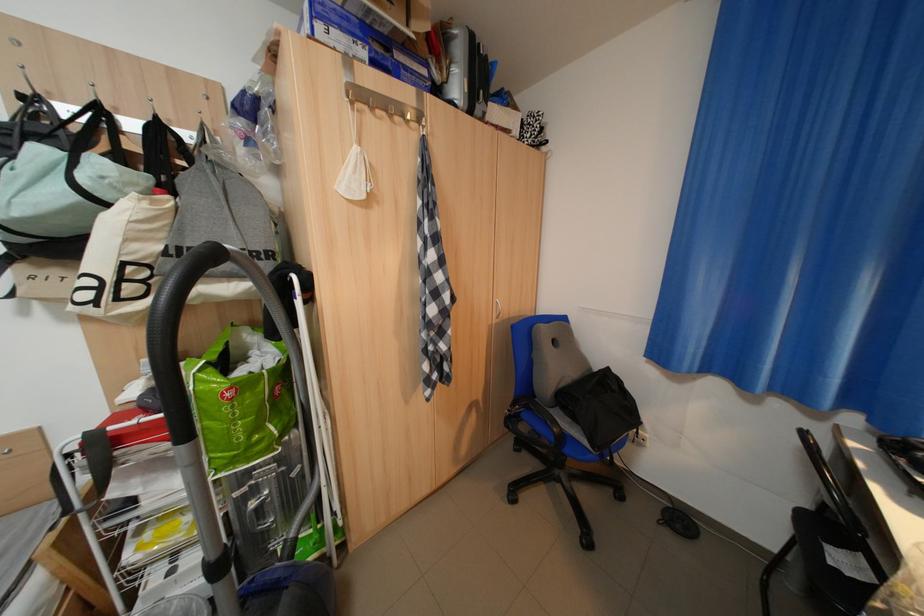
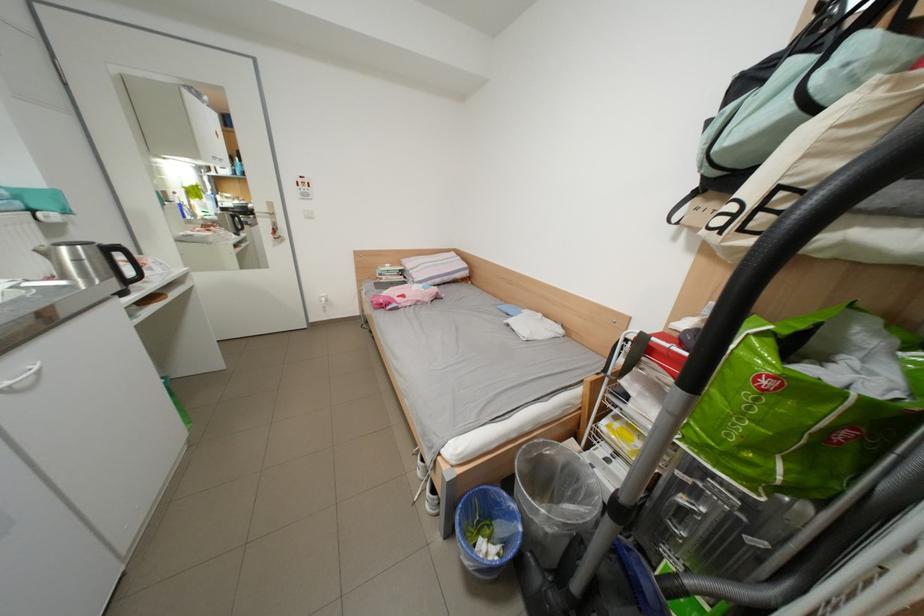
The point at [261,439] is marked in the first image. Where is the corresponding point in the second image?

(754, 448)